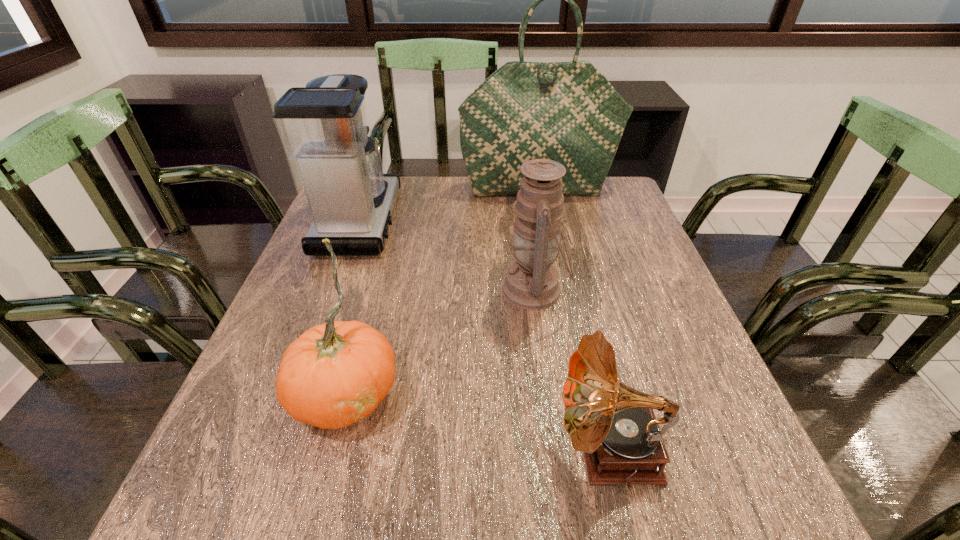
Find the location of `blank region between the coffee maker and the tallest object`. blank region between the coffee maker and the tallest object is located at coordinates (449, 205).

The image size is (960, 540). I want to click on free space that is in between the tote bag and the coffee maker, so click(449, 205).

In order to click on free space between the coffee maker and the pumpkin in this screenshot , I will do `click(353, 307)`.

Where is `unoccupied area between the pumpkin and the oil lamp`? unoccupied area between the pumpkin and the oil lamp is located at coordinates (441, 341).

Locate an element on the screen. The width and height of the screenshot is (960, 540). free space between the tote bag and the coffee maker is located at coordinates (449, 205).

I want to click on the closest object relative to the pumpkin, so click(531, 282).

Where is `the fourth closest object to the second tallest object`? the fourth closest object to the second tallest object is located at coordinates (614, 424).

I want to click on free space that satisfies the following two spatial constraints: 1. on the back side of the oil lamp; 2. at the front of the fourth shortest object where the controls are located, so click(525, 222).

Image resolution: width=960 pixels, height=540 pixels. In order to click on vacant space that satisfies the following two spatial constraints: 1. at the front of the fourth shortest object where the controls are located; 2. on the left side of the pumpkin in this screenshot , I will do `click(298, 392)`.

Where is `vacant region that satisfies the following two spatial constraints: 1. at the front of the coffee maker where the controls are located; 2. on the left side of the pumpkin`? vacant region that satisfies the following two spatial constraints: 1. at the front of the coffee maker where the controls are located; 2. on the left side of the pumpkin is located at coordinates (298, 392).